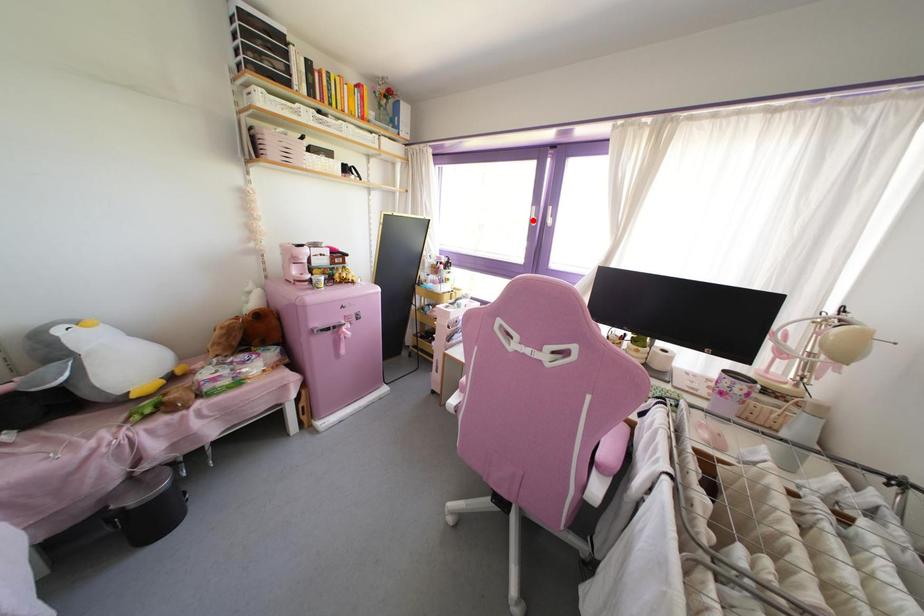
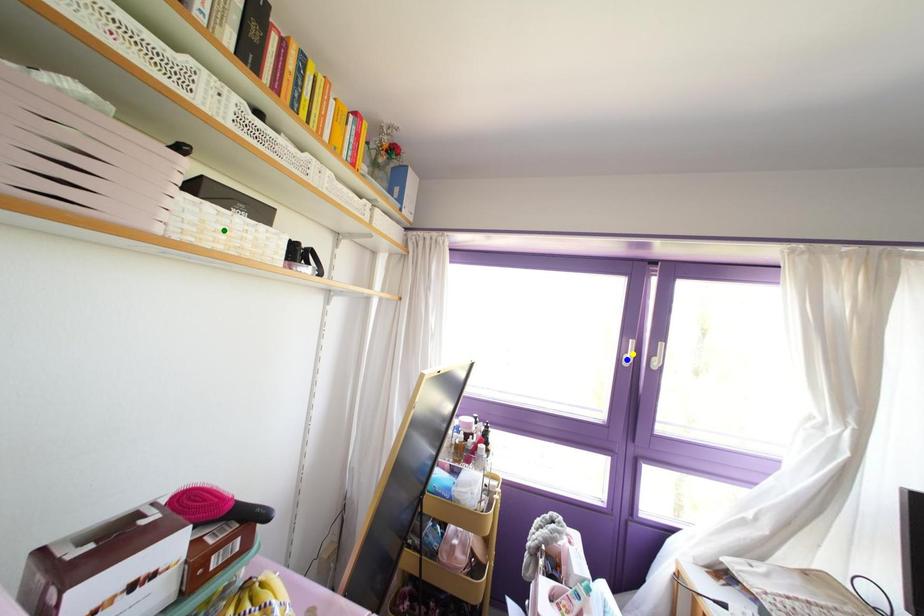
Question: I am providing you with two images of the same scene from different viewpoints. A red point is marked on the first image. You are given multiple points on the second image. Which point in image 2 represents the same 3d spot as the red point in image 1?

Choices:
 (A) yellow point
 (B) green point
 (C) blue point

Answer: (C)